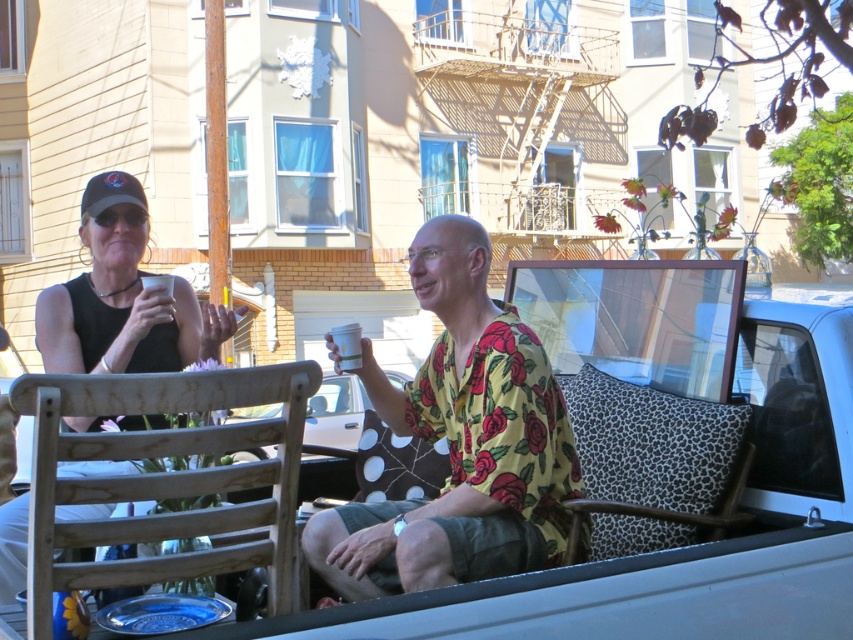
Question: Is the position of yellow floral shirt at center more distant than that of white matte cup at upper center?

Choices:
 (A) yes
 (B) no

Answer: (B)

Question: Is matte black tank top at left below white matte cup at upper center?

Choices:
 (A) no
 (B) yes

Answer: (B)

Question: Estimate the real-world distances between objects in this image. Which object is farther from the wooden chair at center?

Choices:
 (A) white matte cup at upper center
 (B) yellow floral shirt at center
 (C) matte black tank top at left

Answer: (C)

Question: Which object is closer to the camera taking this photo?

Choices:
 (A) yellow floral shirt at center
 (B) white matte cup at upper center

Answer: (A)

Question: Does matte black tank top at left appear under white matte cup at upper center?

Choices:
 (A) no
 (B) yes

Answer: (B)

Question: Which object is the closest to the white matte cup at upper center?

Choices:
 (A) yellow floral shirt at center
 (B) matte black tank top at left

Answer: (A)